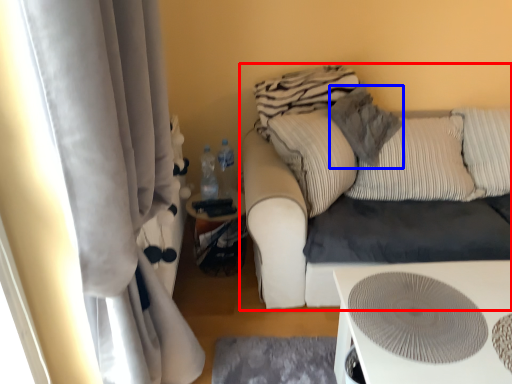
Question: Which object appears farthest to the camera in this image, studio couch (highlighted by a red box) or pillow (highlighted by a blue box)?

Choices:
 (A) studio couch
 (B) pillow

Answer: (B)